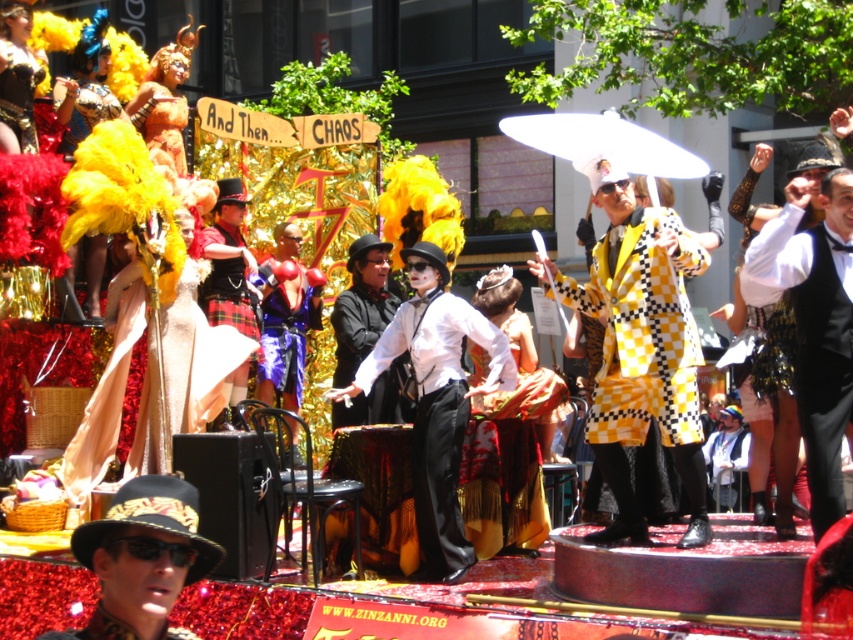
You are a photographer at the parade and want to capture both the white matte suit at center and the velvet purple dress at center in a single frame. Given that your camera has a fixed focus that can only accommodate one width, which one should you focus on to ensure the wider object is in focus?

The white matte suit at center has a greater width than the velvet purple dress at center. Therefore, focusing on the white matte suit at center ensures the wider object is captured in focus.

You are a photographer positioned at the lower left corner of the scene. You want to capture a photo of the black textured hat at center without any obstructions. Based on your position, can you see the hat clearly?

The black textured hat at center is located at point (x=142, y=557), which means it is positioned towards the lower right area of the scene. Since you are at the lower left corner, there might be other elements like the float or participants between you and the hat, potentially obstructing the view. However, without specific information about intervening objects, it is uncertain if there are obstructions. The answer should strictly use the given data. The question should not assume additional details beyond 0

You are a photographer positioned at the center of the scene. You want to capture a photo of the yellow checkered coat at center. Which direction should you aim your camera to ensure the coat is in the frame?

The yellow checkered coat at center is located at point [643,353], which is slightly to the right and above the center of the scene. Aim your camera slightly to the right and upwards to capture it.